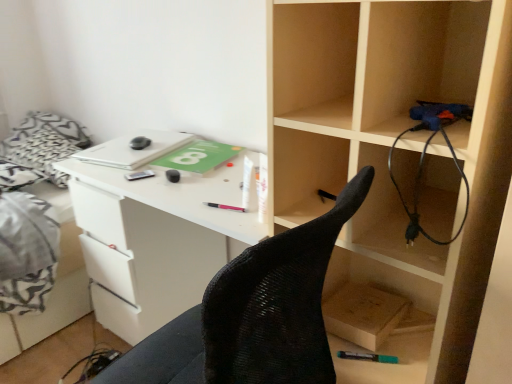
Find the location of a particular element. The height and width of the screenshot is (384, 512). free space to the back side of black rubber mouse at center, acting as the 3th stationery starting from the front is located at coordinates (178, 160).